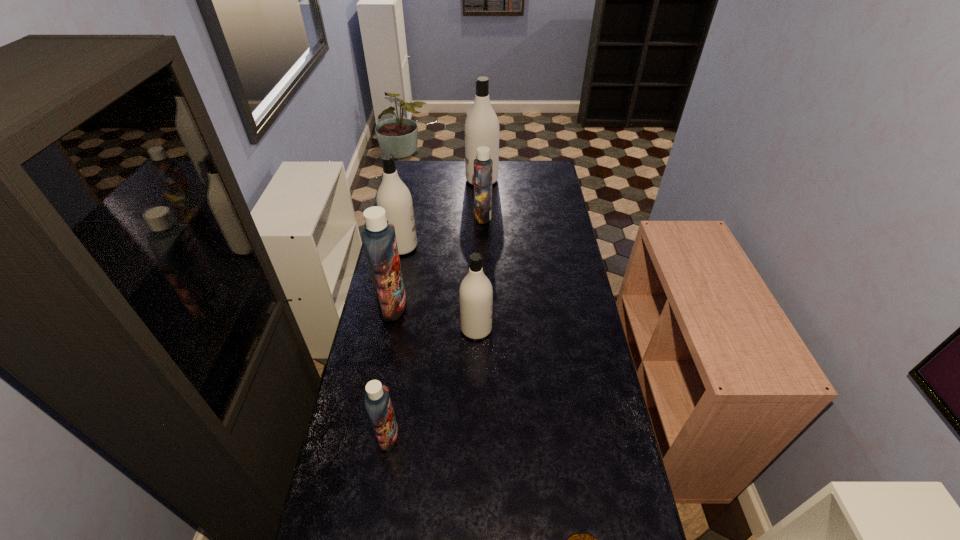
Find the location of a particular element. This screenshot has height=540, width=960. vacant region located 0.230m on the front-facing side of the tallest shampoo is located at coordinates (423, 180).

Locate an element on the screen. free point located on the front-facing side of the tallest shampoo is located at coordinates (414, 180).

I want to click on free space located 0.090m on the front-facing side of the tallest shampoo, so click(x=449, y=180).

Where is `vacant space located on the front-facing side of the fourth nearest shampoo`? This screenshot has width=960, height=540. vacant space located on the front-facing side of the fourth nearest shampoo is located at coordinates (x=462, y=246).

I want to click on free space located on the front label of the second farthest blue shampoo, so click(450, 306).

In order to click on vacant area located on the front label of the farthest blue shampoo in this screenshot , I will do `click(411, 217)`.

At what (x,y) coordinates should I click in order to perform the action: click on vacant space located on the front label of the farthest blue shampoo. Please return your answer as a coordinate pair (x, y). The width and height of the screenshot is (960, 540). Looking at the image, I should click on (425, 217).

At what (x,y) coordinates should I click in order to perform the action: click on vacant region located on the front label of the farthest blue shampoo. Please return your answer as a coordinate pair (x, y). The image size is (960, 540). Looking at the image, I should click on (409, 217).

Where is `free space located 0.260m on the front-facing side of the smallest white shampoo`? The height and width of the screenshot is (540, 960). free space located 0.260m on the front-facing side of the smallest white shampoo is located at coordinates (562, 329).

At what (x,y) coordinates should I click in order to perform the action: click on vacant space positioned 0.380m on the front label of the second shortest object. Please return your answer as a coordinate pair (x, y). Looking at the image, I should click on (522, 436).